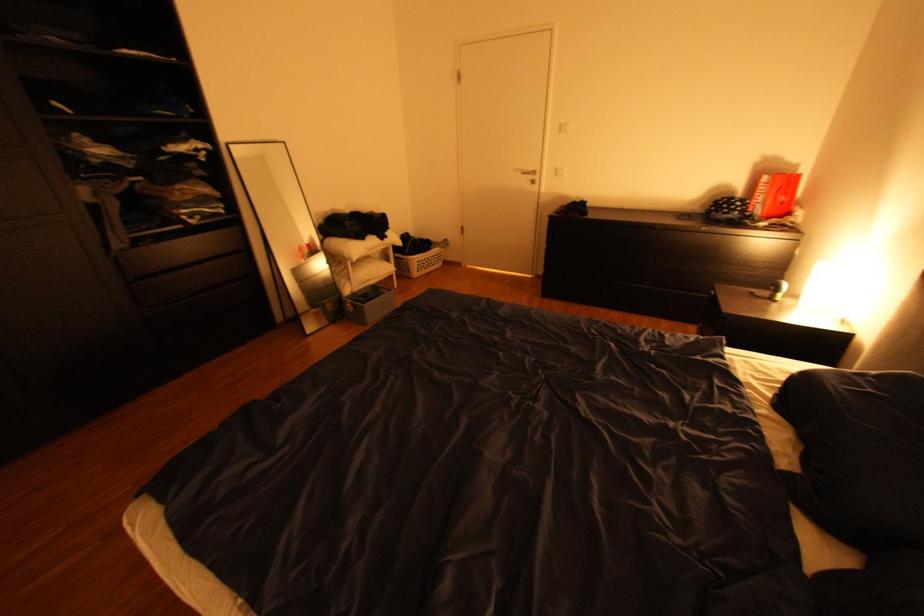
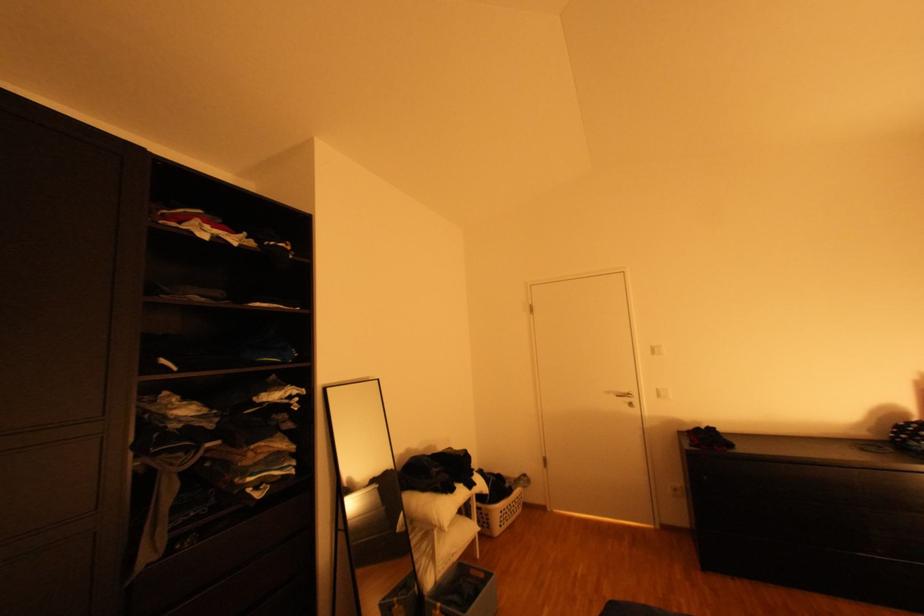
In the second image, find the point that corresponds to point 569,127 in the first image.

(662, 349)